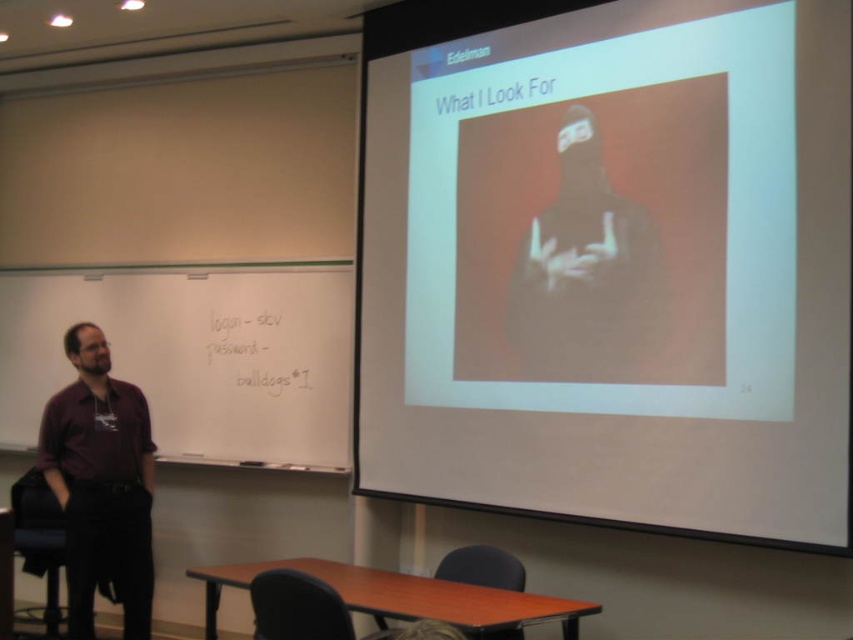
You are a student in the classroom and you need to place a ruler that is 12 inches long on the desk. The desk is between the white matte bottle at center and the dark red shirt at left. Can the ruler fit horizontally on the desk between them?

The white matte bottle at center is wider than the dark red shirt at left, but the total available space between them isn

You are a student sitting in the classroom and want to reach the point at coordinates point (53, 304). If your height is 1.7 meters, can you safely reach that point without standing on a chair?

The distance of point (53, 304) from viewer is 5.05 meters. Since the point is 5.05 meters away, you can safely reach it without needing a chair as it is within a comfortable reach range for a person of 1.7 meters tall.